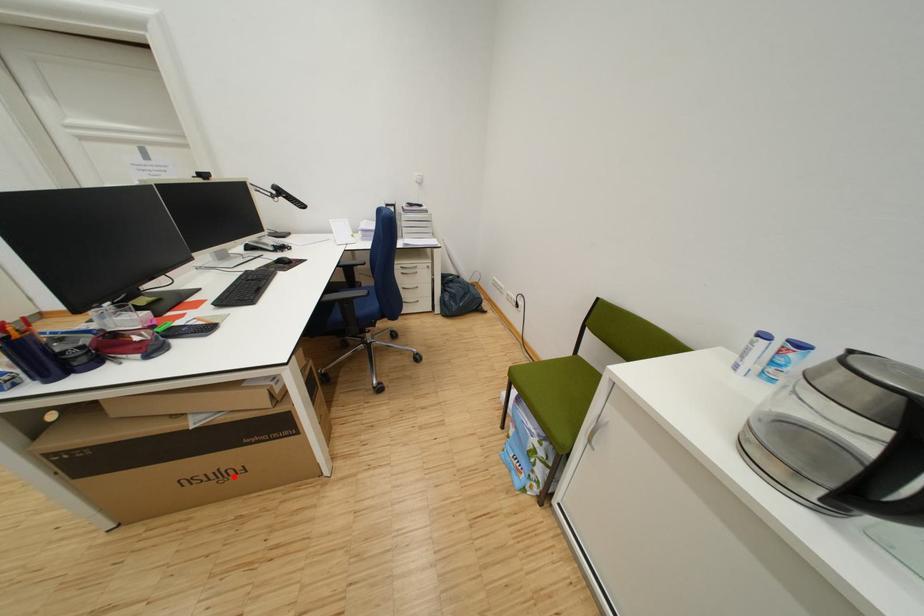
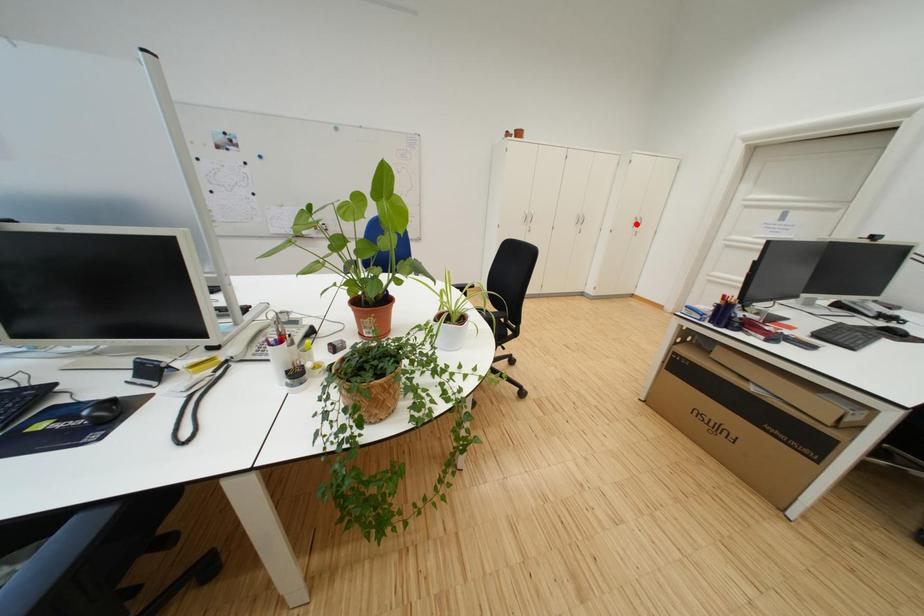
I am providing you with two images of the same scene from different viewpoints. A red point is marked on the first image and another point is marked on the second image. Are the points marked in image1 and image2 representing the same 3D position?

No